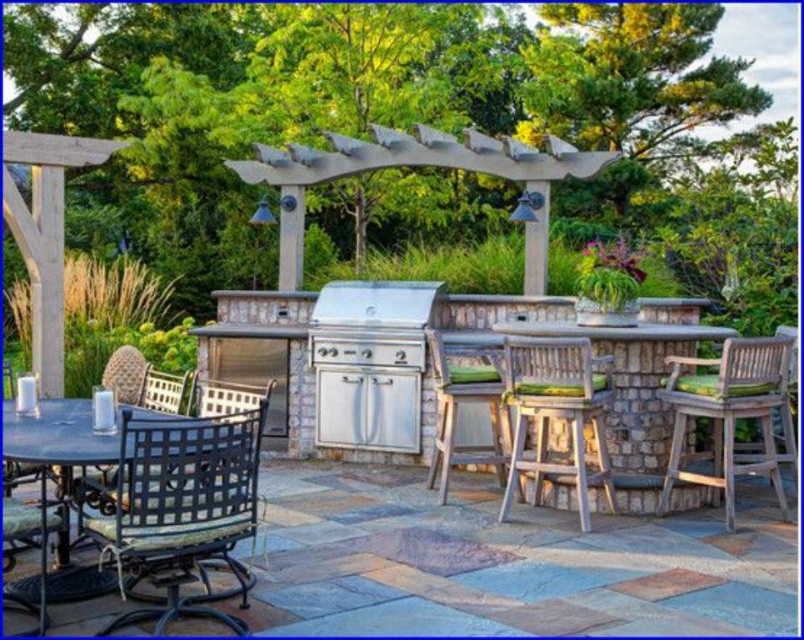
You are planning to seat guests at the patio. You have two chairs available for seating. The metallic black chair at lower left and the metallic woven chair at center. Which chair can accommodate a larger guest more comfortably?

The metallic woven chair at center is larger than the metallic black chair at lower left, so it can accommodate a larger guest more comfortably.

You are planning to move a potted plant from the metallic woven chair at center to the metallic black chair at lower left. Based on their positions, which direction should you move the potted plant?

You should move the potted plant to the left, as the metallic black chair at lower left is positioned to the left of the metallic woven chair at center.